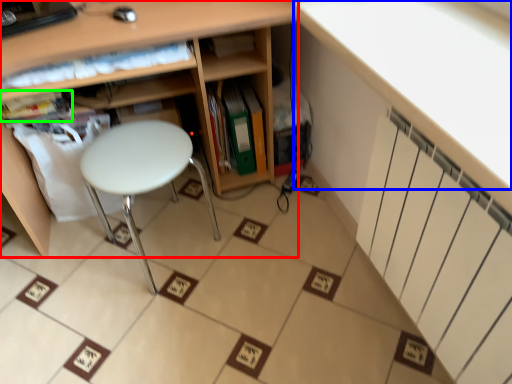
Question: Which object is the closest to the shelf (highlighted by a red box)? Choose among these: counter top (highlighted by a blue box) or book (highlighted by a green box).

Choices:
 (A) counter top
 (B) book

Answer: (B)